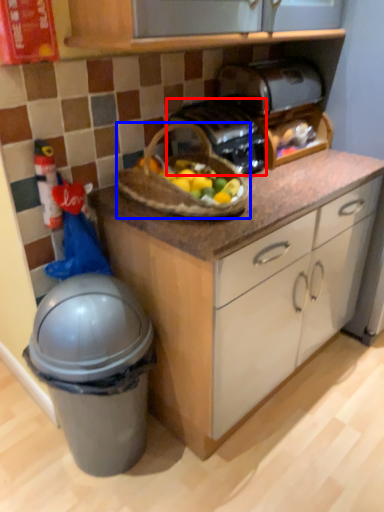
Question: Which point is further to the camera, toaster (highlighted by a red box) or picnic basket (highlighted by a blue box)?

Choices:
 (A) toaster
 (B) picnic basket

Answer: (A)